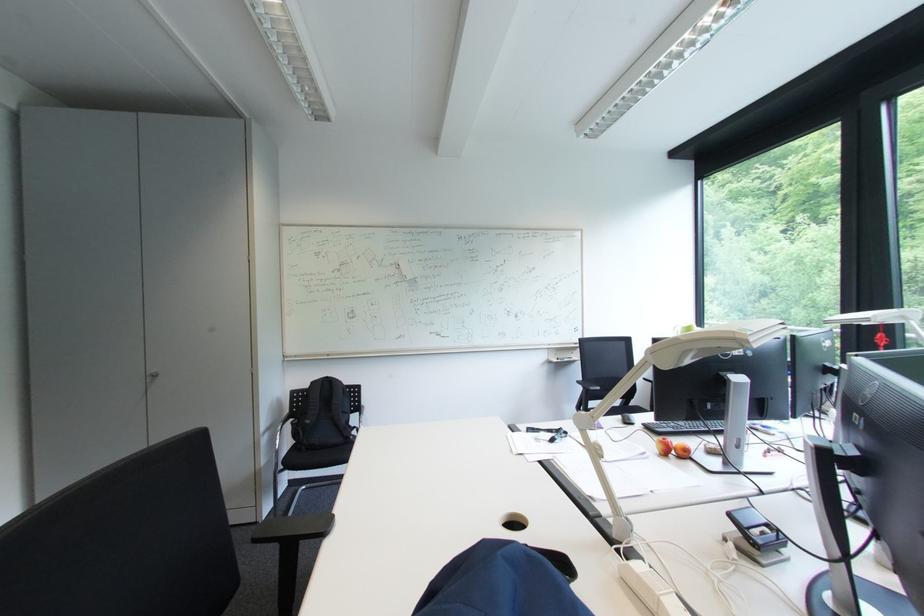
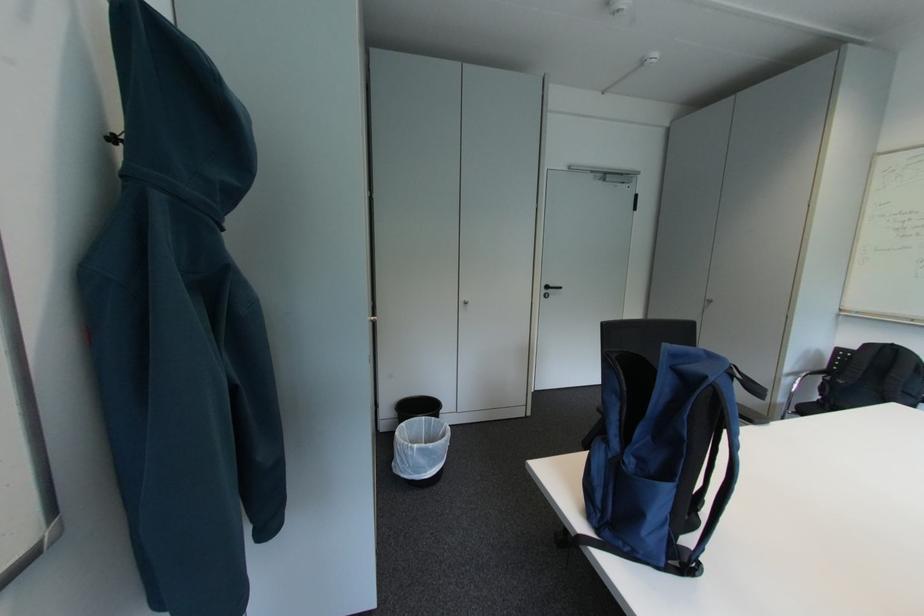
Question: Based on the continuous images, in which direction is the camera rotating? Reply with the corresponding letter.

Choices:
 (A) Left
 (B) Right
 (C) Up
 (D) Down

Answer: (A)